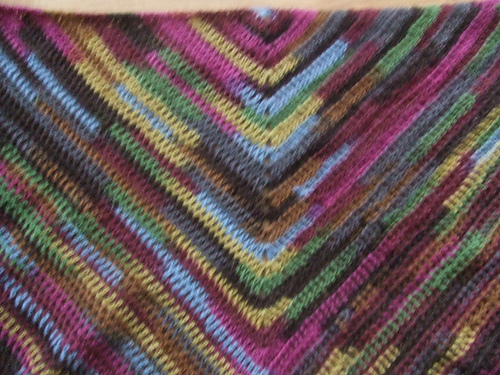
In order to click on fold in blanket in this screenshot , I will do `click(372, 8)`.